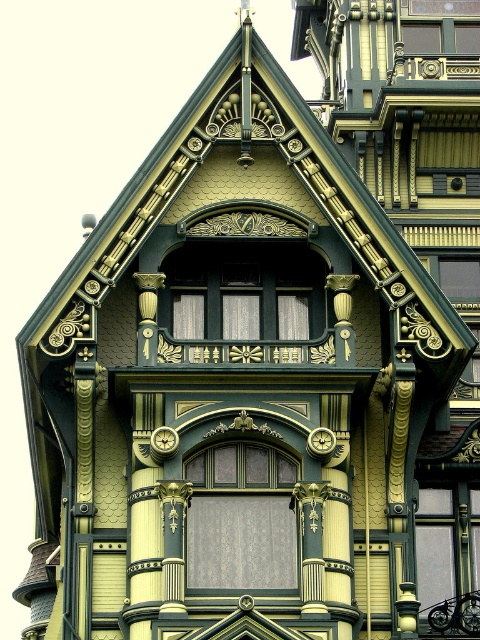
Looking at this image, you are an architect designing a new Victorian building and want to ensure the matte black window at center and the gold metallic clock at center are proportionally balanced. Given their spatial relationship, which object should be placed closer to the edge to maintain symmetry?

The matte black window at center is wider than the gold metallic clock at center. To maintain symmetry, the wider matte black window at center should be placed closer to the edge so that its larger size doesn

You are an architect examining the Victorian building detail. You notice the matte black window at center and the gold metallic clock at center. Which object is located above the other?

The matte black window at center is positioned over the gold metallic clock at center, meaning it is above the clock.